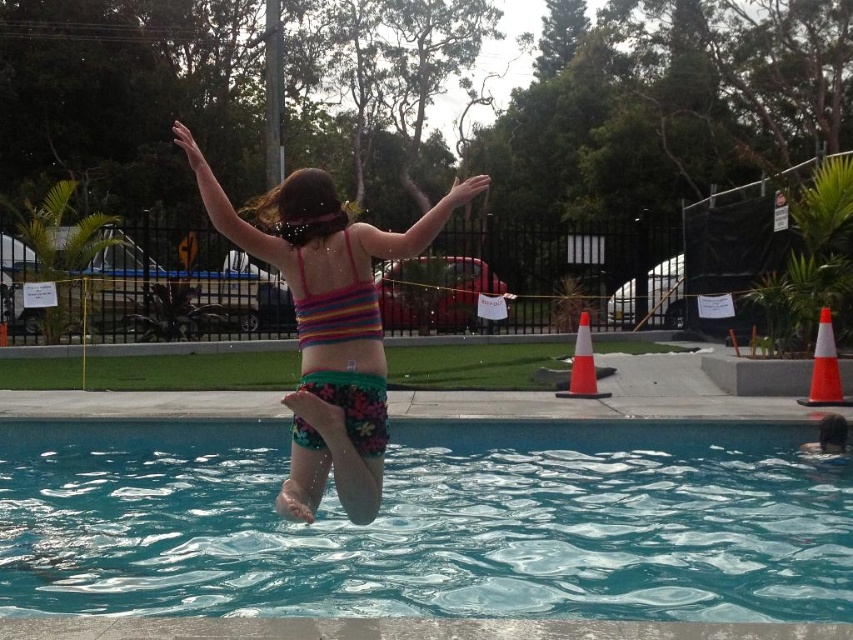
Which is behind, point (837, 547) or point (584, 337)?

Point (584, 337)

Which is in front, point (753, 451) or point (585, 330)?

Point (753, 451)

This screenshot has width=853, height=640. Find the location of `teal glossy water at center`. teal glossy water at center is located at coordinates pyautogui.click(x=428, y=524).

Looking at this image, is multicolored fabric bikini at center in front of orange/white traffic cone at center?

Yes, it is in front of orange/white traffic cone at center.

Does point (312, 500) come in front of point (593, 385)?

Yes, point (312, 500) is in front of point (593, 385).

Does point (274, 196) come farther from viewer compared to point (572, 394)?

No, (274, 196) is in front of (572, 394).

You are a GUI agent. You are given a task and a screenshot of the screen. Output one action in this format:
    pyautogui.click(x=<x>, y=<y>)
    Task: Click on the multicolored fabric bikini at center
    
    Given the screenshot: What is the action you would take?
    pyautogui.click(x=328, y=324)

Between point (792, 499) and point (814, 396), which one is positioned behind?

The point (814, 396) is behind.

Does teal glossy water at center have a greater width compared to orange reflective cone at right?

Yes.

Which is in front, point (711, 554) or point (817, 333)?

Positioned in front is point (711, 554).

Identify the location of teal glossy water at center. The width and height of the screenshot is (853, 640). (428, 524).